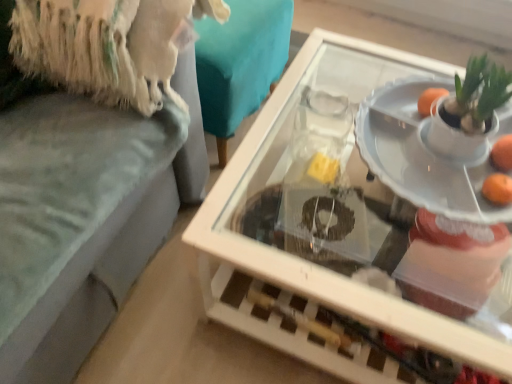
Question: Is orange matte at right, the 1th orange positioned from the bottom, outside of transparent glass table at center?

Choices:
 (A) yes
 (B) no

Answer: (A)

Question: Can you confirm if orange matte at right, which appears as the first orange when viewed from the front, is smaller than transparent glass table at center?

Choices:
 (A) no
 (B) yes

Answer: (B)

Question: Is orange matte at right, placed as the 2th orange when sorted from back to front, bigger than transparent glass table at center?

Choices:
 (A) no
 (B) yes

Answer: (A)

Question: Is orange matte at right, which appears as the first orange when viewed from the front, placed right next to transparent glass table at center?

Choices:
 (A) yes
 (B) no

Answer: (B)

Question: Considering the relative sizes of orange matte at right, which appears as the first orange when viewed from the front, and transparent glass table at center in the image provided, is orange matte at right, which appears as the first orange when viewed from the front, taller than transparent glass table at center?

Choices:
 (A) yes
 (B) no

Answer: (B)

Question: Considering the relative positions of orange matte at right, the second orange in the front-to-back sequence, and orange matte at right, which appears as the first orange when viewed from the front, in the image provided, is orange matte at right, the second orange in the front-to-back sequence, to the left or to the right of orange matte at right, which appears as the first orange when viewed from the front,?

Choices:
 (A) right
 (B) left

Answer: (A)

Question: Looking at the image, does orange matte at right, which is the second orange from bottom to top, seem bigger or smaller compared to orange matte at right, the 1th orange positioned from the bottom?

Choices:
 (A) big
 (B) small

Answer: (A)

Question: From the image's perspective, is orange matte at right, acting as the first orange starting from the top, above or below orange matte at right, placed as the 2th orange when sorted from back to front?

Choices:
 (A) below
 (B) above

Answer: (B)

Question: Considering the positions of orange matte at right, acting as the first orange starting from the top, and orange matte at right, placed as the 2th orange when sorted from back to front, in the image, is orange matte at right, acting as the first orange starting from the top, taller or shorter than orange matte at right, placed as the 2th orange when sorted from back to front,?

Choices:
 (A) short
 (B) tall

Answer: (B)

Question: Would you say transparent glass table at center is inside or outside white glossy plate at center?

Choices:
 (A) outside
 (B) inside

Answer: (A)

Question: Is transparent glass table at center taller or shorter than white glossy plate at center?

Choices:
 (A) tall
 (B) short

Answer: (A)

Question: From the image's perspective, is transparent glass table at center located above or below white glossy plate at center?

Choices:
 (A) below
 (B) above

Answer: (A)

Question: Is transparent glass table at center bigger or smaller than white glossy plate at center?

Choices:
 (A) big
 (B) small

Answer: (A)

Question: Is transparent glass table at center wider or thinner than orange matte at right, the 1th orange positioned from the bottom?

Choices:
 (A) thin
 (B) wide

Answer: (B)

Question: Is transparent glass table at center to the left or to the right of orange matte at right, placed as the 2th orange when sorted from top to bottom, in the image?

Choices:
 (A) left
 (B) right

Answer: (A)